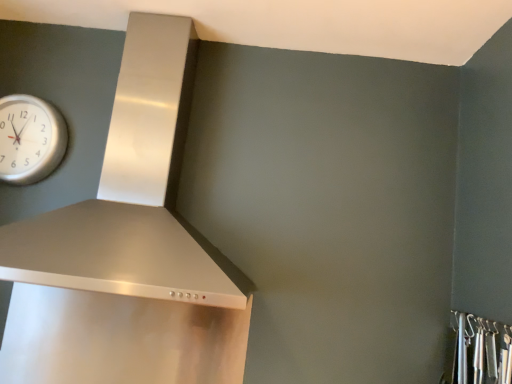
Question: Is metallic silver hooks at lower right bigger than silver metallic clock at upper left?

Choices:
 (A) yes
 (B) no

Answer: (B)

Question: Can you see metallic silver hooks at lower right touching silver metallic clock at upper left?

Choices:
 (A) yes
 (B) no

Answer: (B)

Question: Would you say silver metallic clock at upper left is part of metallic silver hooks at lower right's contents?

Choices:
 (A) no
 (B) yes

Answer: (A)

Question: Considering the relative sizes of metallic silver hooks at lower right and silver metallic clock at upper left in the image provided, is metallic silver hooks at lower right shorter than silver metallic clock at upper left?

Choices:
 (A) yes
 (B) no

Answer: (A)

Question: Considering the relative positions of metallic silver hooks at lower right and silver metallic clock at upper left in the image provided, is metallic silver hooks at lower right to the right of silver metallic clock at upper left from the viewer's perspective?

Choices:
 (A) no
 (B) yes

Answer: (B)

Question: Is silver metallic clock at upper left at the back of metallic silver hooks at lower right?

Choices:
 (A) yes
 (B) no

Answer: (B)

Question: Considering the relative sizes of satin silver vent at upper left and silver metallic clock at upper left in the image provided, is satin silver vent at upper left smaller than silver metallic clock at upper left?

Choices:
 (A) yes
 (B) no

Answer: (B)

Question: Would you say satin silver vent at upper left contains silver metallic clock at upper left?

Choices:
 (A) no
 (B) yes

Answer: (A)

Question: Could you tell me if satin silver vent at upper left is turned towards silver metallic clock at upper left?

Choices:
 (A) yes
 (B) no

Answer: (B)

Question: Would you say satin silver vent at upper left is a long distance from silver metallic clock at upper left?

Choices:
 (A) no
 (B) yes

Answer: (A)

Question: From the image's perspective, is satin silver vent at upper left below silver metallic clock at upper left?

Choices:
 (A) no
 (B) yes

Answer: (B)

Question: Is satin silver vent at upper left turned away from silver metallic clock at upper left?

Choices:
 (A) no
 (B) yes

Answer: (A)

Question: From a real-world perspective, is satin silver vent at upper left physically above metallic silver hooks at lower right?

Choices:
 (A) no
 (B) yes

Answer: (B)